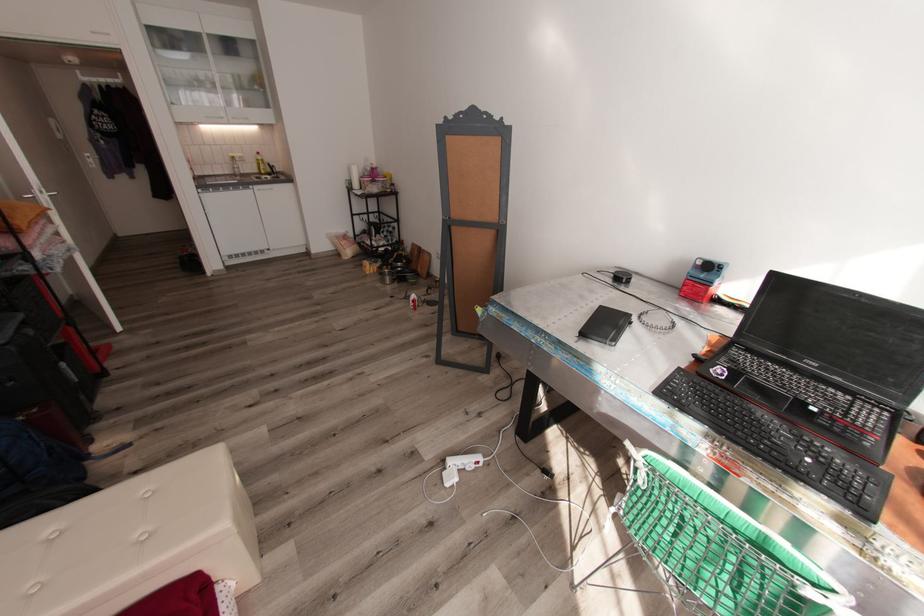
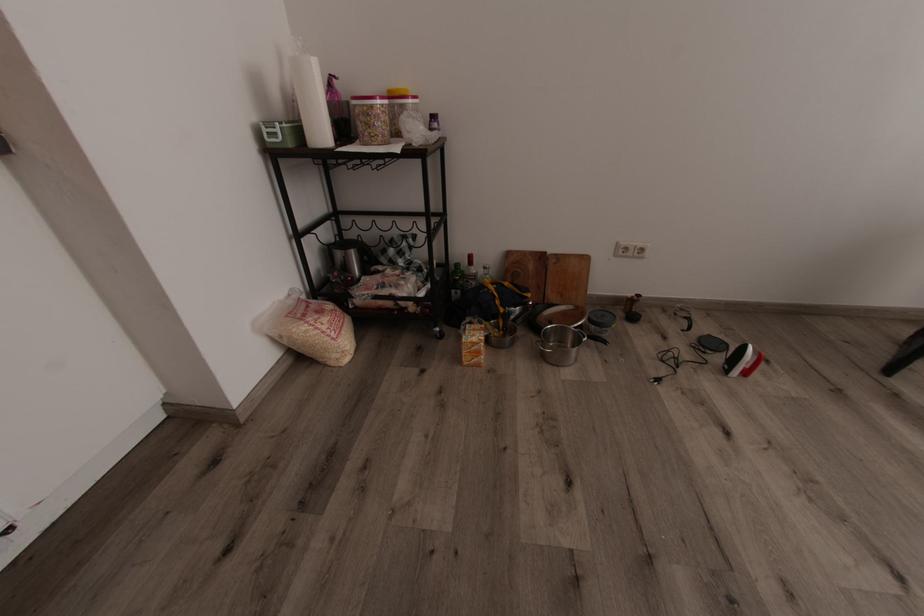
The point at (369, 183) is marked in the first image. Where is the corresponding point in the second image?

(382, 116)